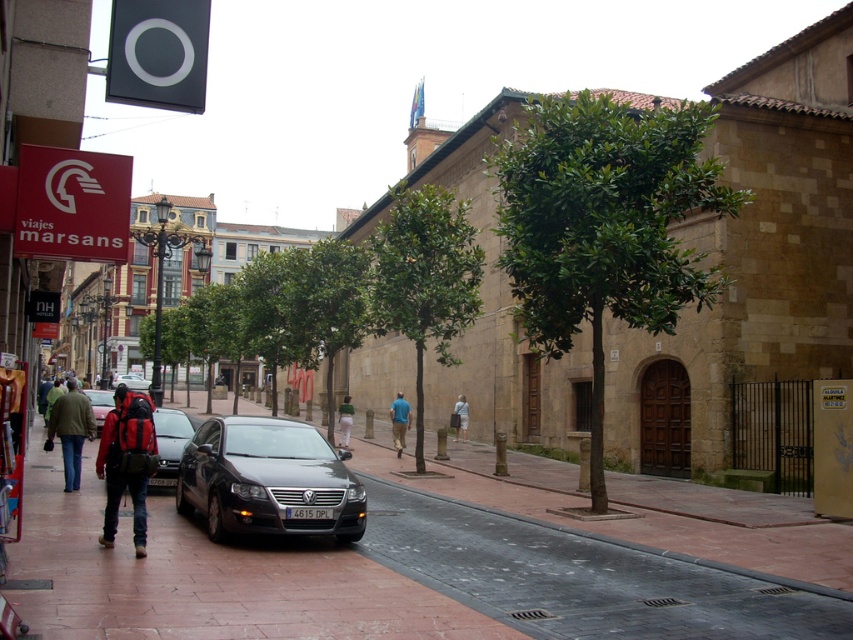
You are a delivery person who needs to park your 1.5 meter tall delivery box in this street scene. You see the silver metallic sedan at center and the green fabric jacket at left. Which object is shorter and can accommodate the delivery box height?

The silver metallic sedan at center is not as tall as the green fabric jacket at left, so the silver metallic sedan at center is shorter and can accommodate the delivery box height of 1.5 meters.

You are a delivery person trying to navigate a narrow alleyway that is only 1.8 meters wide. You see a silver metallic sedan at center and a green fabric jacket at left. Can you determine if the sedan will fit through the alleyway based on their widths?

The silver metallic sedan at center might be wider than green fabric jacket at left. Since the alleyway is 1.8 meters wide, if the sedan is wider than the jacket, it may not fit. However, without exact measurements, it is uncertain. Please check the sedan width before proceeding.

You are a pedestrian standing on the sidewalk on the left side of the street in the European town scene. You see a satin black car at center and a silver metallic sedan at center. Can you safely cross the street between these two vehicles without needing to walk more than 40 meters?

The distance between the satin black car at center and the silver metallic sedan at center is 39.74 meters, so yes, you can safely cross the street between them since the required distance is less than 40 meters.